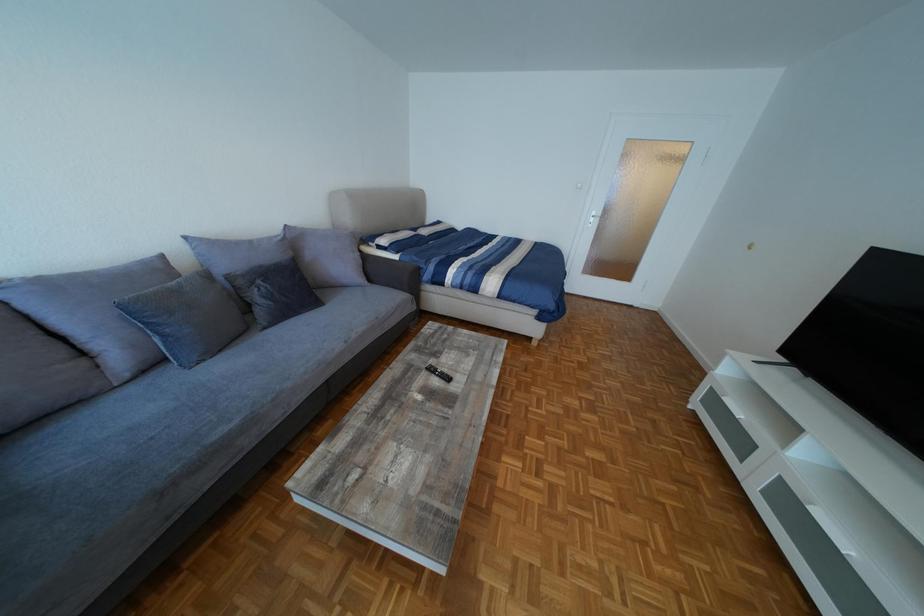
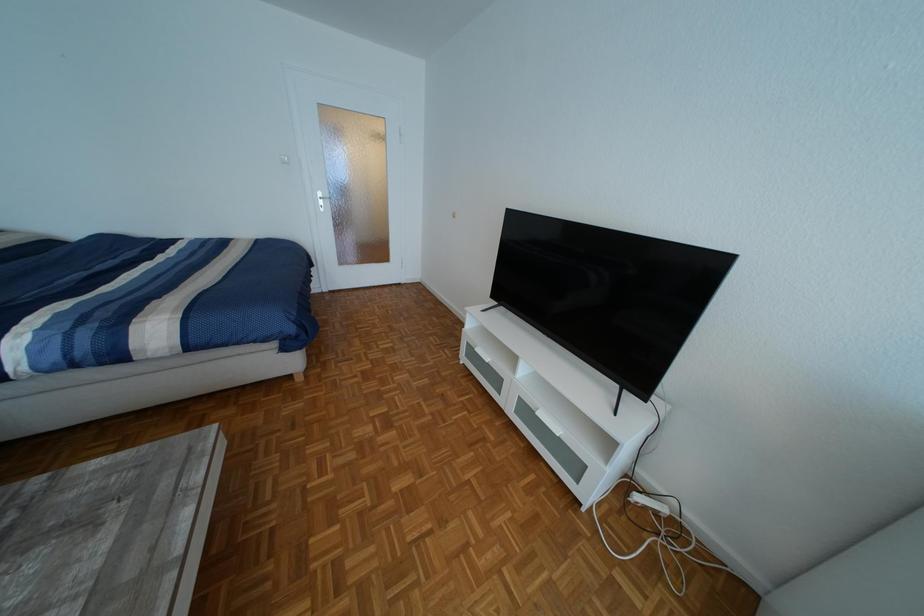
Question: The camera is either moving clockwise (left) or counter-clockwise (right) around the object. The first image is from the beginning of the video and the second image is from the end. Is the camera moving left or right when shooting the video?

Choices:
 (A) Left
 (B) Right

Answer: (A)